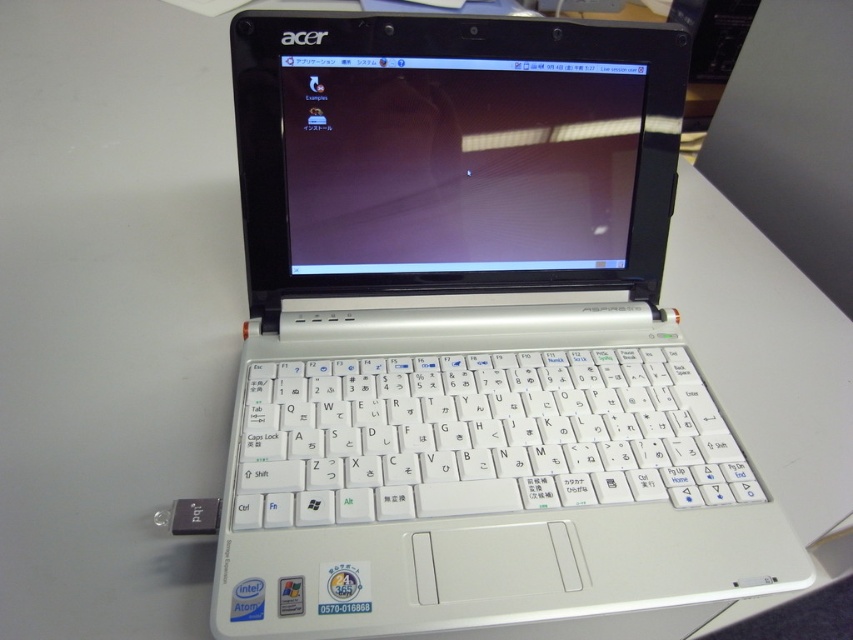
Question: Estimate the real-world distances between objects in this image. Which object is farther from the white plastic keyboard at center?

Choices:
 (A) white plastic laptop at center
 (B) matte plastic screen at center

Answer: (B)

Question: Does white plastic laptop at center appear on the right side of white plastic keyboard at center?

Choices:
 (A) no
 (B) yes

Answer: (A)

Question: Can you confirm if white plastic keyboard at center is positioned above matte plastic screen at center?

Choices:
 (A) no
 (B) yes

Answer: (A)

Question: Which point appears farthest from the camera in this image?

Choices:
 (A) (392, 102)
 (B) (474, 120)
 (C) (494, 385)

Answer: (C)

Question: Estimate the real-world distances between objects in this image. Which object is farther from the matte plastic screen at center?

Choices:
 (A) white plastic laptop at center
 (B) white plastic keyboard at center

Answer: (B)

Question: Is white plastic laptop at center to the right of matte plastic screen at center from the viewer's perspective?

Choices:
 (A) no
 (B) yes

Answer: (B)